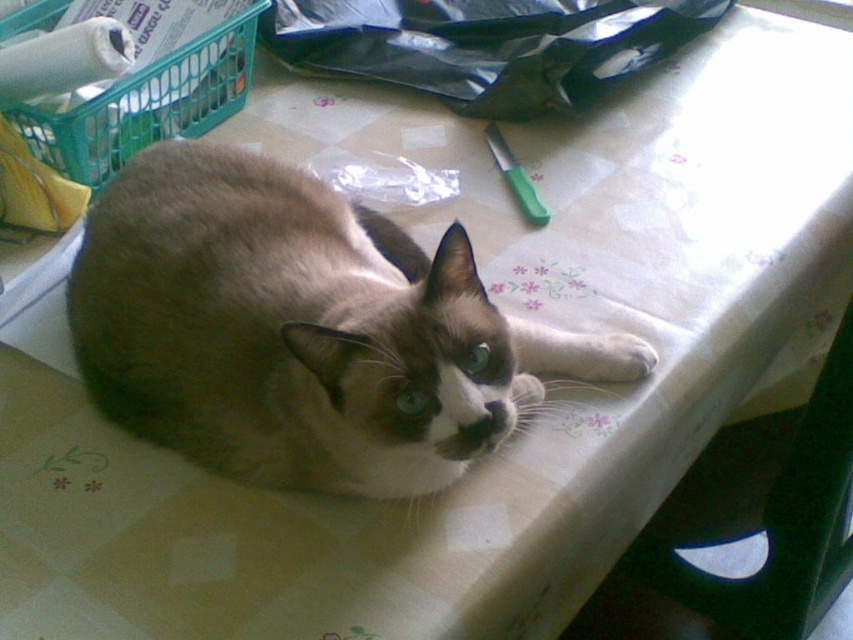
Question: Among these objects, which one is nearest to the camera?

Choices:
 (A) silky fur cat at center
 (B) green plastic basket at upper left

Answer: (A)

Question: Does silky fur cat at center lie in front of green plastic basket at upper left?

Choices:
 (A) yes
 (B) no

Answer: (A)

Question: Which object appears closest to the camera in this image?

Choices:
 (A) green plastic basket at upper left
 (B) silky fur cat at center

Answer: (B)

Question: Is silky fur cat at center above green plastic basket at upper left?

Choices:
 (A) yes
 (B) no

Answer: (B)

Question: Is silky fur cat at center wider than green plastic chair at lower right?

Choices:
 (A) yes
 (B) no

Answer: (A)

Question: Which point appears closest to the camera in this image?

Choices:
 (A) [155, 65]
 (B) [839, 588]

Answer: (A)